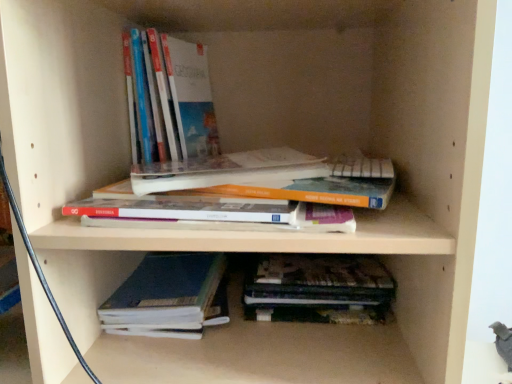
Question: In which direction should I rotate to look at hardcover book at center, the 2th book when ordered from top to bottom?

Choices:
 (A) right
 (B) left

Answer: (B)

Question: From a real-world perspective, is dark blue hardcover book at lower center, marked as the 1th book in a bottom-to-top arrangement, on top of hardcover book at upper left, which appears as the 4th book when ordered from the bottom?

Choices:
 (A) yes
 (B) no

Answer: (B)

Question: Is dark blue hardcover book at lower center, marked as the 1th book in a bottom-to-top arrangement, next to hardcover book at upper left, which appears as the 4th book when ordered from the bottom, and touching it?

Choices:
 (A) yes
 (B) no

Answer: (B)

Question: Is dark blue hardcover book at lower center, the fourth book from the top, wider than hardcover book at upper left, which is the 1th book from top to bottom?

Choices:
 (A) no
 (B) yes

Answer: (A)

Question: Can you confirm if dark blue hardcover book at lower center, the fourth book from the top, is positioned to the right of hardcover book at upper left, which is the 1th book from top to bottom?

Choices:
 (A) yes
 (B) no

Answer: (A)

Question: From the image's perspective, is dark blue hardcover book at lower center, marked as the 1th book in a bottom-to-top arrangement, located above hardcover book at upper left, which appears as the 4th book when ordered from the bottom?

Choices:
 (A) no
 (B) yes

Answer: (A)

Question: Would you say dark blue hardcover book at lower center, the fourth book from the top, contains hardcover book at upper left, which appears as the 4th book when ordered from the bottom?

Choices:
 (A) yes
 (B) no

Answer: (B)

Question: Does dark blue hardcover book at lower center, the fourth book from the top, have a larger size compared to dark brown leather book at lower center, which appears as the 3th book when viewed from the top?

Choices:
 (A) no
 (B) yes

Answer: (B)

Question: Would you say dark blue hardcover book at lower center, marked as the 1th book in a bottom-to-top arrangement, is outside dark brown leather book at lower center, which appears as the 3th book when viewed from the top?

Choices:
 (A) yes
 (B) no

Answer: (A)

Question: From a real-world perspective, is dark blue hardcover book at lower center, marked as the 1th book in a bottom-to-top arrangement, positioned under dark brown leather book at lower center, which appears as the 3th book when viewed from the top, based on gravity?

Choices:
 (A) no
 (B) yes

Answer: (B)

Question: Could you tell me if dark blue hardcover book at lower center, marked as the 1th book in a bottom-to-top arrangement, is facing dark brown leather book at lower center, which appears as the 3th book when viewed from the top?

Choices:
 (A) no
 (B) yes

Answer: (A)

Question: Can you confirm if dark blue hardcover book at lower center, the fourth book from the top, is smaller than dark brown leather book at lower center, which is counted as the second book, starting from the bottom?

Choices:
 (A) yes
 (B) no

Answer: (B)

Question: Considering the relative sizes of dark blue hardcover book at lower center, marked as the 1th book in a bottom-to-top arrangement, and dark brown leather book at lower center, which is counted as the second book, starting from the bottom, in the image provided, is dark blue hardcover book at lower center, marked as the 1th book in a bottom-to-top arrangement, wider than dark brown leather book at lower center, which is counted as the second book, starting from the bottom,?

Choices:
 (A) no
 (B) yes

Answer: (B)

Question: From the image's perspective, is hardcover book at center, positioned as the 3th book in bottom-to-top order, under dark blue hardcover book at lower center, marked as the 1th book in a bottom-to-top arrangement?

Choices:
 (A) no
 (B) yes

Answer: (A)